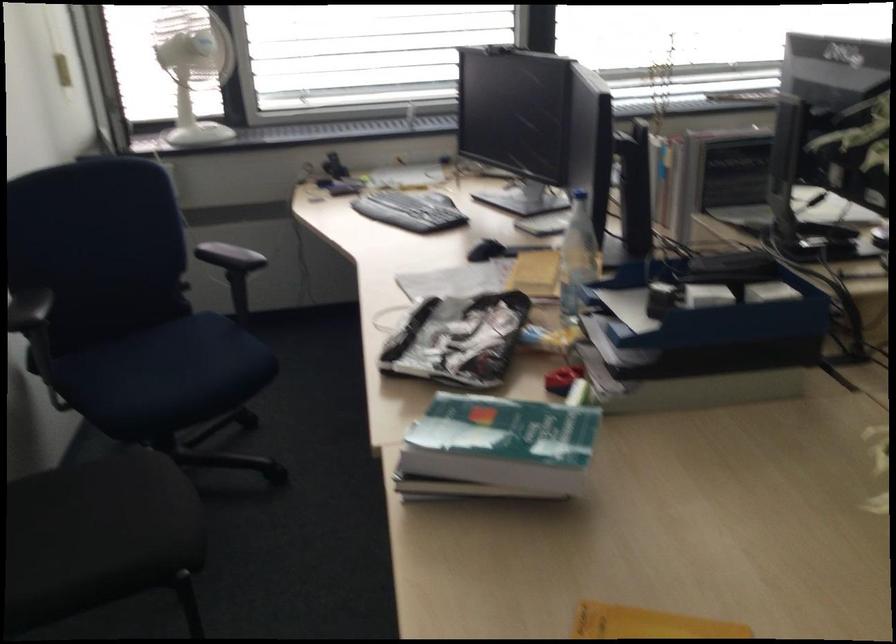
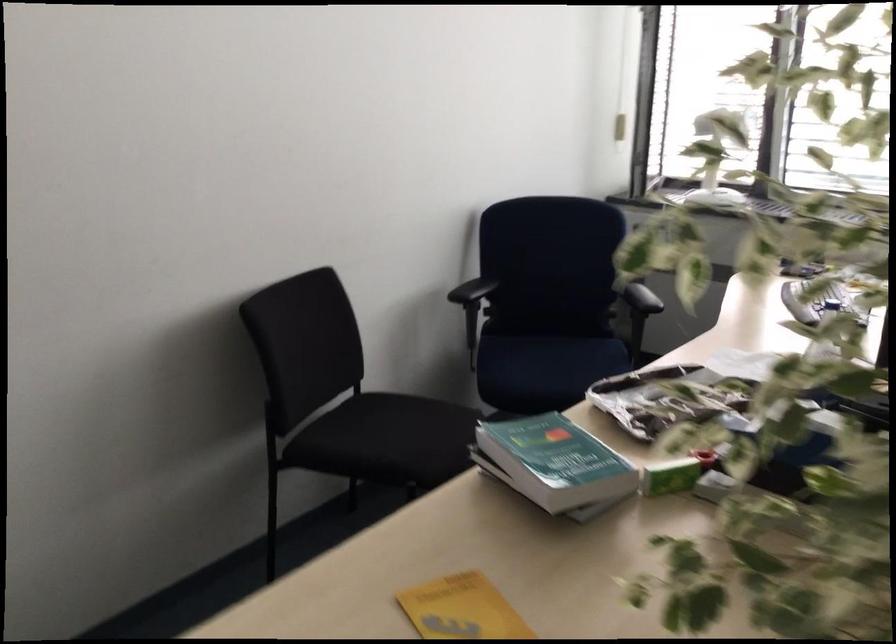
The point at [177,377] is marked in the first image. Where is the corresponding point in the second image?

(547, 366)